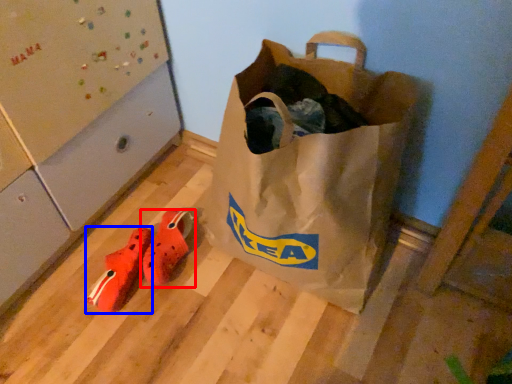
Question: Which object is closer to the camera taking this photo, footwear (highlighted by a red box) or shoe (highlighted by a blue box)?

Choices:
 (A) footwear
 (B) shoe

Answer: (B)